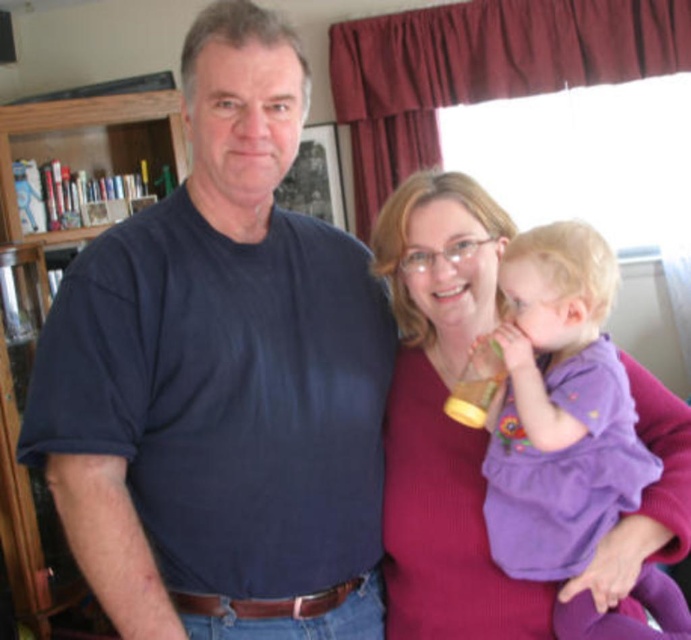
You are a photographer setting up for a family photo. You need to ensure that the purple soft fabric baby at center and the wooden bookshelf at left are both visible in the frame. Based on their sizes, which object should you prioritize positioning closer to the camera to ensure it doesn not get lost in the background?

The purple soft fabric baby at center should be positioned closer to the camera because its width is smaller than the wooden bookshelf at left, making it easier to ensure it is visible in the frame without being overshadowed by the larger bookshelf.